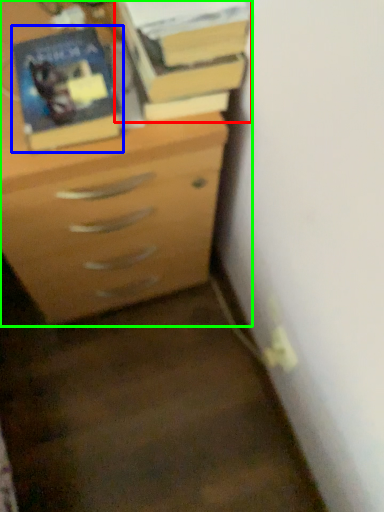
Question: Based on their relative distances, which object is nearer to book (highlighted by a red box)? Choose from paperback book (highlighted by a blue box) and chest of drawers (highlighted by a green box).

Choices:
 (A) paperback book
 (B) chest of drawers

Answer: (A)